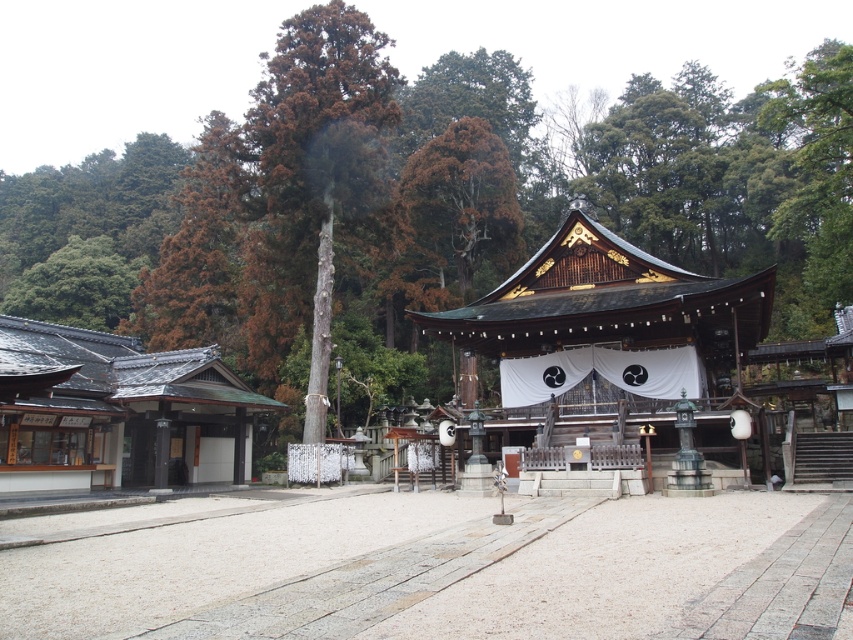
You are a visitor at the shrine and want to take a photo of both the brown wood tree at center and the wooden shrine at center. Which object should you focus on first if you want to include both in the frame without moving the camera?

You should focus on the wooden shrine at center first because it is smaller than the brown wood tree at center, allowing more space to include both in the frame.

Consider the image. You are standing in front of the shrine and want to take a photo. You notice two points marked in the scene. Which point is closer to your camera lens when capturing the shrine? Please choose between the point at (196, 211) and the point at (469, 330).

Point (196, 211) is closer to the camera lens because it is further to the camera than point (469, 330) according to the description.

You are visiting a traditional Japanese shrine and want to take a photo of both the brown wood tree at center and the wooden shrine at center. Which object should you focus on first if you want to capture both in the same frame without moving your camera?

You should focus on the wooden shrine at center first because the brown wood tree at center is taller than the wooden shrine at center, so adjusting the camera angle to include the taller tree might require a wider shot that still captures the shrine.